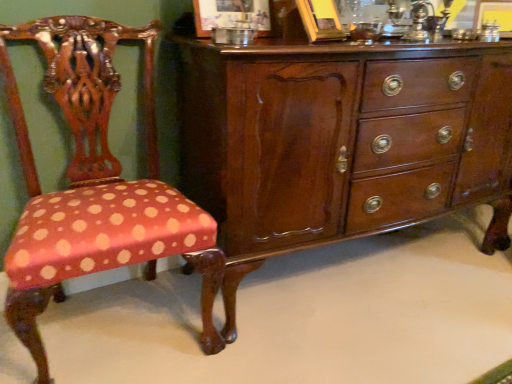
Locate an element on the screen. mahogany wood chest of drawers at center is located at coordinates (341, 142).

Measure the distance between point [503,139] and camera.

The depth of point [503,139] is 5.51 feet.

Describe the element at coordinates (341, 142) in the screenshot. The width and height of the screenshot is (512, 384). I see `mahogany wood chest of drawers at center` at that location.

What is the approximate height of polka dot fabric chair at left?

It is 38.72 inches.

Image resolution: width=512 pixels, height=384 pixels. What do you see at coordinates (95, 184) in the screenshot?
I see `polka dot fabric chair at left` at bounding box center [95, 184].

The width and height of the screenshot is (512, 384). Identify the location of polka dot fabric chair at left. (95, 184).

At what (x,y) coordinates should I click in order to perform the action: click on mahogany wood chest of drawers at center. Please return your answer as a coordinate pair (x, y). The image size is (512, 384). Looking at the image, I should click on (341, 142).

Is mahogany wood chest of drawers at center to the right of polka dot fabric chair at left from the viewer's perspective?

Indeed, mahogany wood chest of drawers at center is positioned on the right side of polka dot fabric chair at left.

Is mahogany wood chest of drawers at center in front of or behind polka dot fabric chair at left in the image?

Clearly, mahogany wood chest of drawers at center is behind polka dot fabric chair at left.

Between point (430, 69) and point (59, 88), which one is positioned in front?

Positioned in front is point (430, 69).

From the image's perspective, would you say mahogany wood chest of drawers at center is shown under polka dot fabric chair at left?

Incorrect, from the image's perspective, mahogany wood chest of drawers at center is higher than polka dot fabric chair at left.

Looking at this image, from a real-world perspective, which object rests below the other?

From a 3D spatial view, mahogany wood chest of drawers at center is below.

Considering the relative sizes of mahogany wood chest of drawers at center and polka dot fabric chair at left in the image provided, is mahogany wood chest of drawers at center wider than polka dot fabric chair at left?

Correct, the width of mahogany wood chest of drawers at center exceeds that of polka dot fabric chair at left.

Which of these two, mahogany wood chest of drawers at center or polka dot fabric chair at left, stands shorter?

With less height is mahogany wood chest of drawers at center.

Can you confirm if mahogany wood chest of drawers at center is bigger than polka dot fabric chair at left?

Yes, mahogany wood chest of drawers at center is bigger than polka dot fabric chair at left.

Is mahogany wood chest of drawers at center spatially inside polka dot fabric chair at left, or outside of it?

The correct answer is: outside.

Is the surface of mahogany wood chest of drawers at center in direct contact with polka dot fabric chair at left?

mahogany wood chest of drawers at center and polka dot fabric chair at left are clearly separated.

Is mahogany wood chest of drawers at center facing away from polka dot fabric chair at left?

That's not correct — mahogany wood chest of drawers at center is not looking away from polka dot fabric chair at left.

How much distance is there between mahogany wood chest of drawers at center and polka dot fabric chair at left?

mahogany wood chest of drawers at center and polka dot fabric chair at left are 18.85 inches apart from each other.

Locate an element on the screen. Image resolution: width=512 pixels, height=384 pixels. chest of drawers located on the right of polka dot fabric chair at left is located at coordinates (341, 142).

Would you say polka dot fabric chair at left is to the left or to the right of mahogany wood chest of drawers at center in the picture?

In the image, polka dot fabric chair at left appears on the left side of mahogany wood chest of drawers at center.

Which object is more forward, polka dot fabric chair at left or mahogany wood chest of drawers at center?

polka dot fabric chair at left is closer to the camera.

Between point (210, 285) and point (388, 194), which one is positioned behind?

The point (388, 194) is more distant.

From the image's perspective, is polka dot fabric chair at left above or below mahogany wood chest of drawers at center?

Clearly, from the image's perspective, polka dot fabric chair at left is below mahogany wood chest of drawers at center.

From a real-world perspective, is polka dot fabric chair at left physically located above or below mahogany wood chest of drawers at center?

polka dot fabric chair at left is above mahogany wood chest of drawers at center.

Which object is thinner, polka dot fabric chair at left or mahogany wood chest of drawers at center?

Thinner between the two is polka dot fabric chair at left.

Can you confirm if polka dot fabric chair at left is shorter than mahogany wood chest of drawers at center?

No, polka dot fabric chair at left is not shorter than mahogany wood chest of drawers at center.

Is polka dot fabric chair at left bigger than mahogany wood chest of drawers at center?

Actually, polka dot fabric chair at left might be smaller than mahogany wood chest of drawers at center.

Is polka dot fabric chair at left completely or partially outside of mahogany wood chest of drawers at center?

Yes.

Is polka dot fabric chair at left directly adjacent to mahogany wood chest of drawers at center?

No, polka dot fabric chair at left is not next to mahogany wood chest of drawers at center.

Is polka dot fabric chair at left facing away from mahogany wood chest of drawers at center?

That's not correct — polka dot fabric chair at left is not looking away from mahogany wood chest of drawers at center.

How different are the orientations of polka dot fabric chair at left and mahogany wood chest of drawers at center in degrees?

0.000586 degrees separate the facing orientations of polka dot fabric chair at left and mahogany wood chest of drawers at center.

You are a GUI agent. You are given a task and a screenshot of the screen. Output one action in this format:
    pyautogui.click(x=<x>, y=<y>)
    Task: Click on the chair that appears on the left of mahogany wood chest of drawers at center
    Image resolution: width=512 pixels, height=384 pixels.
    Given the screenshot: What is the action you would take?
    pyautogui.click(x=95, y=184)

Find the location of `chest of drawers on the right of polka dot fabric chair at left`. chest of drawers on the right of polka dot fabric chair at left is located at coordinates (341, 142).

In the image, there is a mahogany wood chest of drawers at center. Where is `chair below it (from the image's perspective)`? The width and height of the screenshot is (512, 384). chair below it (from the image's perspective) is located at coordinates (95, 184).